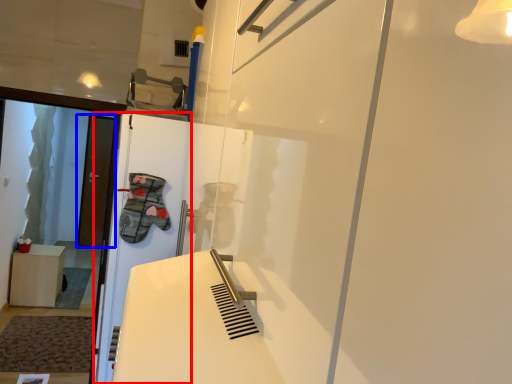
Question: Which object is further to the camera taking this photo, screen door (highlighted by a red box) or door (highlighted by a blue box)?

Choices:
 (A) screen door
 (B) door

Answer: (B)